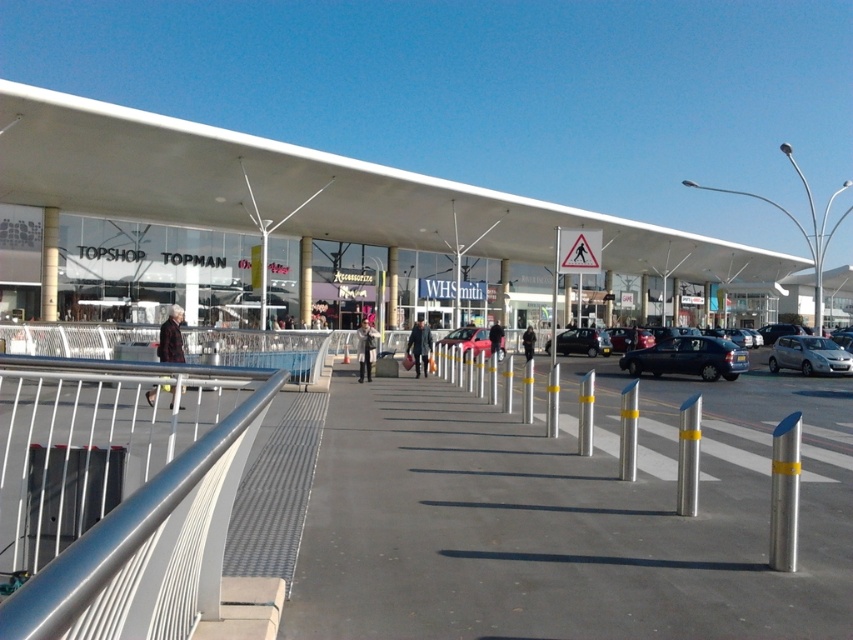
Between gray concrete pavement at center and metallic red car at center, which one is positioned higher?

Positioned higher is metallic red car at center.

Which is behind, point (376, 589) or point (453, 330)?

The point (453, 330) is behind.

At what (x,y) coordinates should I click in order to perform the action: click on gray concrete pavement at center. Please return your answer as a coordinate pair (x, y). The image size is (853, 640). Looking at the image, I should click on (561, 518).

Is point (194, 554) less distant than point (454, 339)?

That is True.

This screenshot has width=853, height=640. What do you see at coordinates (119, 493) in the screenshot?
I see `silver metallic rail at lower left` at bounding box center [119, 493].

Does point (39, 365) come behind point (474, 353)?

No.

The image size is (853, 640). I want to click on silver metallic rail at lower left, so click(x=119, y=493).

Does silver metallic rail at lower left lie behind matte black car at center?

No, silver metallic rail at lower left is in front of matte black car at center.

Does silver metallic rail at lower left have a lesser width compared to matte black car at center?

Incorrect, silver metallic rail at lower left's width is not less than matte black car at center's.

Which is behind, point (166, 584) or point (563, 342)?

Positioned behind is point (563, 342).

This screenshot has height=640, width=853. In order to click on silver metallic rail at lower left in this screenshot , I will do `click(119, 493)`.